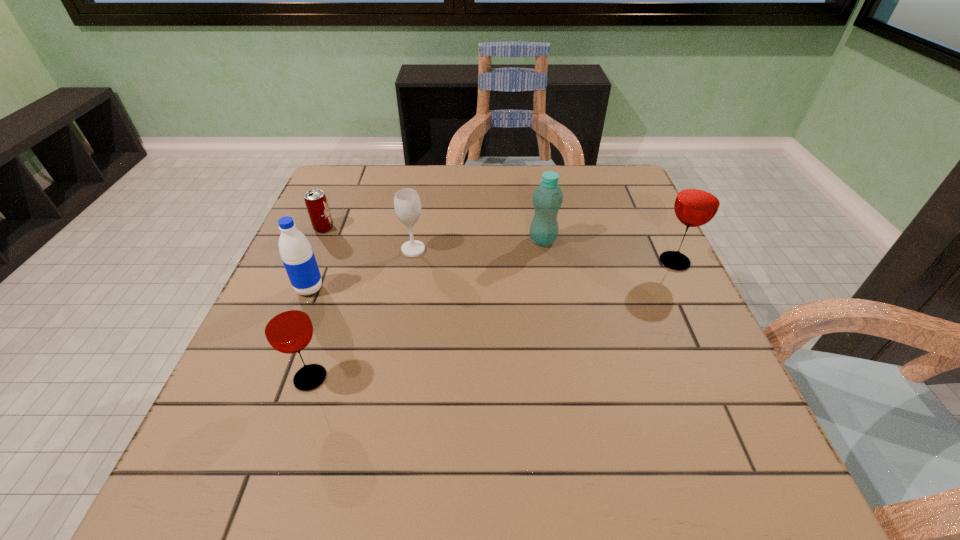
The image size is (960, 540). Identify the location of the nearer glass. (287, 326).

The height and width of the screenshot is (540, 960). Identify the location of the left glass. (287, 326).

At what (x,y) coordinates should I click in order to perform the action: click on the rightmost object. Please return your answer as a coordinate pair (x, y). Image resolution: width=960 pixels, height=540 pixels. Looking at the image, I should click on (697, 202).

Find the location of a particular element. the right glass is located at coordinates (x=697, y=202).

Image resolution: width=960 pixels, height=540 pixels. I want to click on the fifth farthest object, so click(298, 258).

Where is `the nearer water bottle`? the nearer water bottle is located at coordinates click(x=298, y=258).

I want to click on the third object from right to left, so click(x=407, y=205).

You are a GUI agent. You are given a task and a screenshot of the screen. Output one action in this format:
    pyautogui.click(x=<x>, y=<y>)
    Task: Click on the fifth tallest object
    
    Given the screenshot: What is the action you would take?
    pyautogui.click(x=407, y=205)

Where is `beer can`? This screenshot has height=540, width=960. beer can is located at coordinates (316, 203).

You are a GUI agent. You are given a task and a screenshot of the screen. Output one action in this format:
    pyautogui.click(x=<x>, y=<y>)
    Task: Click on the farther water bottle
    Image resolution: width=960 pixels, height=540 pixels.
    Given the screenshot: What is the action you would take?
    pyautogui.click(x=547, y=198)